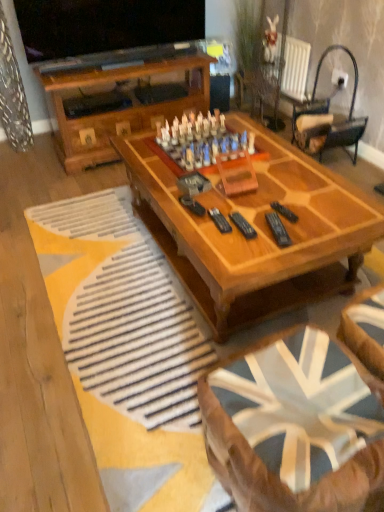
This screenshot has height=512, width=384. What are the coordinates of `vacant area that is situated to the right of black plastic remote at center, which appears as the third remote when viewed from the right` in the screenshot? It's located at (284, 226).